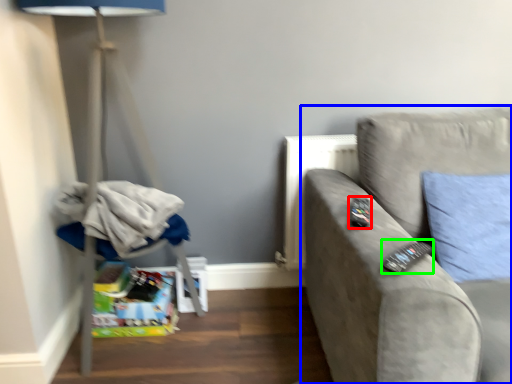
Question: Considering the real-world distances, which object is closest to remote (highlighted by a red box)? studio couch (highlighted by a blue box) or remote (highlighted by a green box).

Choices:
 (A) studio couch
 (B) remote

Answer: (B)